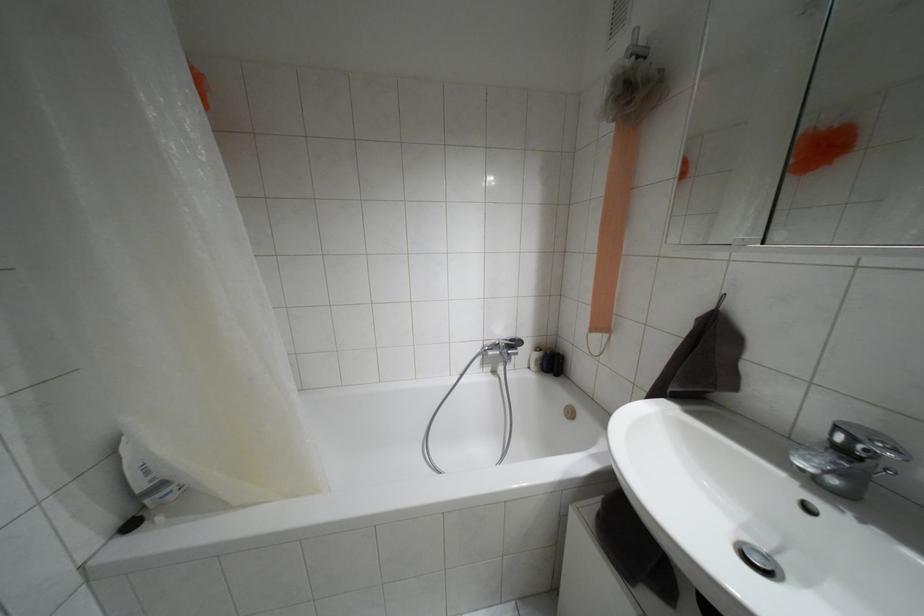
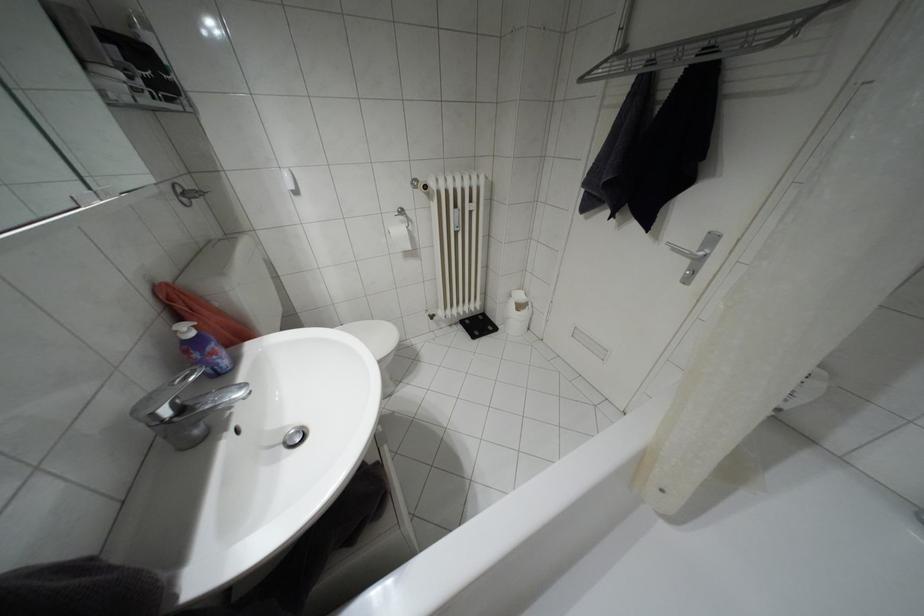
Find the pixel in the second image that matches point 843,450 in the first image.

(180, 408)